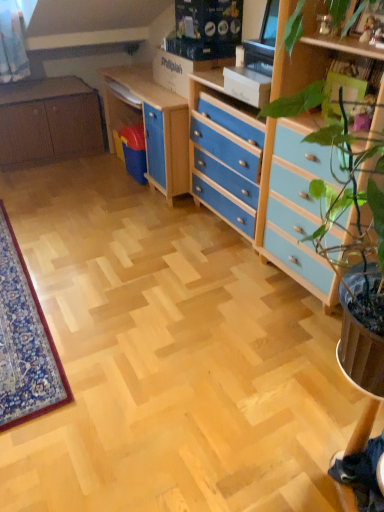
What do you see at coordinates (224, 152) in the screenshot? I see `blue painted wood chest of drawers at center right` at bounding box center [224, 152].

Find the location of a particular element. matte brown cabinet at left is located at coordinates (48, 120).

Considering the positions of objects matte wood computer desk at center and blue painted wood chest of drawers at center right in the image provided, who is in front, matte wood computer desk at center or blue painted wood chest of drawers at center right?

matte wood computer desk at center is closer to the camera.

Based on the photo, is matte wood computer desk at center with blue painted wood chest of drawers at center right?

matte wood computer desk at center and blue painted wood chest of drawers at center right are clearly separated.

Considering the sizes of objects matte wood computer desk at center and blue painted wood chest of drawers at center right in the image provided, who is smaller, matte wood computer desk at center or blue painted wood chest of drawers at center right?

matte wood computer desk at center.

Is blue painted wood chest of drawers at center right a part of matte wood computer desk at center?

Definitely not — blue painted wood chest of drawers at center right is not inside matte wood computer desk at center.

Measure the distance between matte wood computer desk at center and matte brown cabinet at left.

matte wood computer desk at center is 10.62 feet from matte brown cabinet at left.

Which is less distant, (x=366, y=412) or (x=73, y=142)?

Point (x=366, y=412).

Considering the positions of objects matte wood computer desk at center and matte brown cabinet at left in the image provided, who is more to the left, matte wood computer desk at center or matte brown cabinet at left?

From the viewer's perspective, matte brown cabinet at left appears more on the left side.

This screenshot has width=384, height=512. In the image, there is a matte wood computer desk at center. Find the location of `cabinetry above it (from the image's perspective)`. cabinetry above it (from the image's perspective) is located at coordinates (48, 120).

Would you say blue painted wood chest of drawers at center right is inside or outside matte brown cabinet at left?

blue painted wood chest of drawers at center right is located beyond the bounds of matte brown cabinet at left.

Based on the photo, considering the sizes of blue painted wood chest of drawers at center right and matte brown cabinet at left in the image, is blue painted wood chest of drawers at center right taller or shorter than matte brown cabinet at left?

Clearly, blue painted wood chest of drawers at center right is taller compared to matte brown cabinet at left.

Is point (197, 90) positioned after point (11, 113)?

No, it is in front of (11, 113).

Is blue painted wood chest of drawers at center right looking in the opposite direction of matte brown cabinet at left?

No, blue painted wood chest of drawers at center right is not facing the opposite direction of matte brown cabinet at left.

Is blue painted wood chest of drawers at center right beside matte wood computer desk at center?

No.

Is blue painted wood chest of drawers at center right facing towards matte wood computer desk at center?

No, blue painted wood chest of drawers at center right is not oriented towards matte wood computer desk at center.

Does blue painted wood chest of drawers at center right have a greater width compared to matte wood computer desk at center?

Yes, blue painted wood chest of drawers at center right is wider than matte wood computer desk at center.

Which point is more forward, (256, 167) or (340, 475)?

The point (340, 475) is closer.

Is matte brown cabinet at left beside matte wood computer desk at center?

matte brown cabinet at left is not next to matte wood computer desk at center, and they're not touching.

Does matte brown cabinet at left appear on the left side of matte wood computer desk at center?

Correct, you'll find matte brown cabinet at left to the left of matte wood computer desk at center.

Between matte brown cabinet at left and matte wood computer desk at center, which one is positioned behind?

matte brown cabinet at left is behind.

From the image's perspective, between matte brown cabinet at left and matte wood computer desk at center, which one is located above?

matte brown cabinet at left is shown above in the image.

Is matte brown cabinet at left far from blue painted wood chest of drawers at center right?

Yes, matte brown cabinet at left and blue painted wood chest of drawers at center right are located far from each other.

Does point (71, 143) lie in front of point (207, 163)?

No.

Considering the relative sizes of matte brown cabinet at left and blue painted wood chest of drawers at center right in the image provided, is matte brown cabinet at left smaller than blue painted wood chest of drawers at center right?

No.

This screenshot has height=512, width=384. Find the location of `cabinetry below the blue painted wood chest of drawers at center right (from a real-world perspective)`. cabinetry below the blue painted wood chest of drawers at center right (from a real-world perspective) is located at coordinates (48, 120).

Where is `computer desk in front of the blue painted wood chest of drawers at center right`? The height and width of the screenshot is (512, 384). computer desk in front of the blue painted wood chest of drawers at center right is located at coordinates (354, 442).

You are a GUI agent. You are given a task and a screenshot of the screen. Output one action in this format:
    pyautogui.click(x=<x>, y=<y>)
    Task: Click on the computer desk located underneath the matte brown cabinet at left (from a real-world perspective)
    This screenshot has height=512, width=384.
    Given the screenshot: What is the action you would take?
    pyautogui.click(x=354, y=442)

When comparing their distances from blue painted wood chest of drawers at center right, does matte brown cabinet at left or matte wood computer desk at center seem further?

matte wood computer desk at center is further to blue painted wood chest of drawers at center right.

Considering their positions, is blue painted wood chest of drawers at center right positioned further to matte wood computer desk at center than matte brown cabinet at left?

matte brown cabinet at left is positioned further to the anchor matte wood computer desk at center.

Which object lies nearer to the anchor point blue painted wood chest of drawers at center right, matte wood computer desk at center or matte brown cabinet at left?

matte brown cabinet at left.

Which object lies nearer to the anchor point matte brown cabinet at left, blue painted wood chest of drawers at center right or matte wood computer desk at center?

blue painted wood chest of drawers at center right is positioned closer to the anchor matte brown cabinet at left.

From the image, which object appears to be farther from matte wood computer desk at center, matte brown cabinet at left or blue painted wood chest of drawers at center right?

Among the two, matte brown cabinet at left is located further to matte wood computer desk at center.

When comparing their distances from matte brown cabinet at left, does matte wood computer desk at center or blue painted wood chest of drawers at center right seem further?

Based on the image, matte wood computer desk at center appears to be further to matte brown cabinet at left.

Find the location of a particular element. This screenshot has height=512, width=384. chest of drawers between matte brown cabinet at left and matte wood computer desk at center is located at coordinates (224, 152).